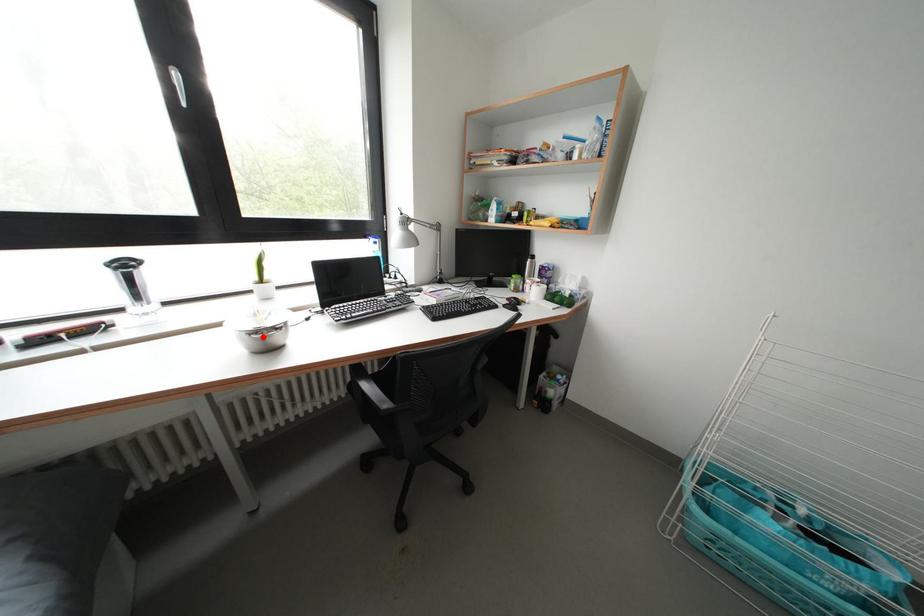
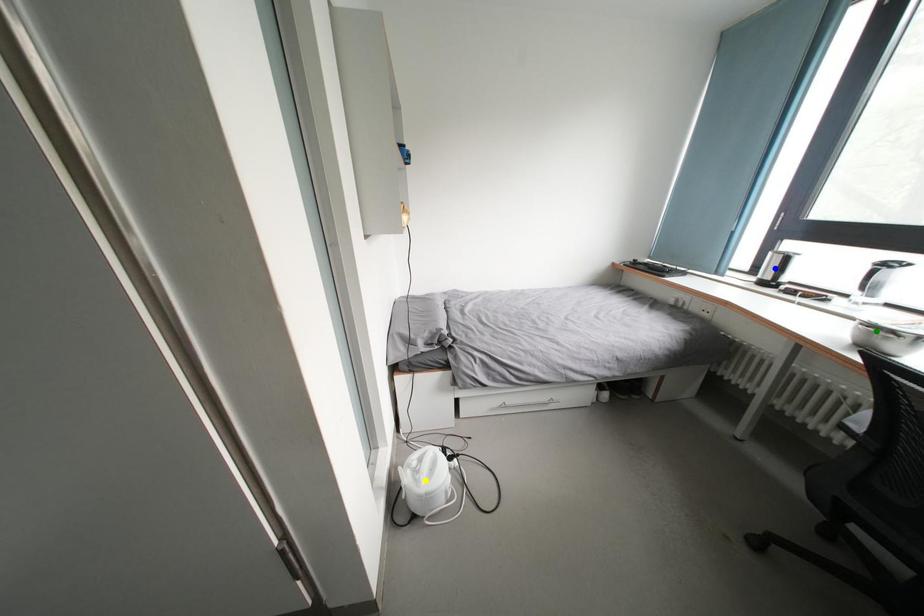
Question: I am providing you with two images of the same scene from different viewpoints. A red point is marked on the first image. You are given multiple points on the second image. Which point in image 2 is actually the same real-world point as the red point in image 1?

Choices:
 (A) green point
 (B) blue point
 (C) yellow point

Answer: (A)